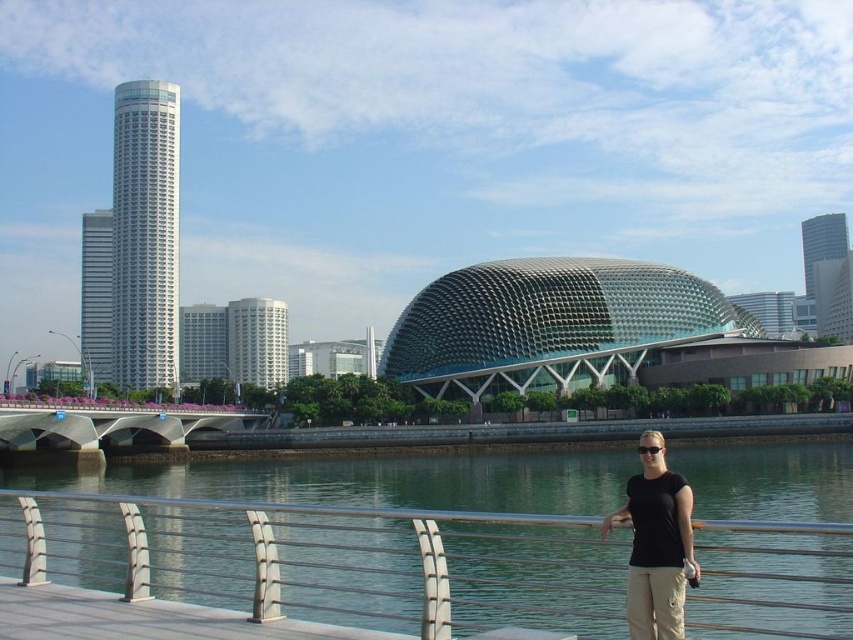
Does black matte shirt at lower center have a greater width compared to concrete bridge at center?

No.

From the picture: Does black matte shirt at lower center appear under concrete bridge at center?

No.

Does point (660, 582) lie behind point (84, 435)?

No, it is in front of (84, 435).

Image resolution: width=853 pixels, height=640 pixels. I want to click on black matte shirt at lower center, so click(x=656, y=544).

Is greenish-blue water at lower center smaller than black matte shirt at lower center?

Actually, greenish-blue water at lower center might be larger than black matte shirt at lower center.

Looking at this image, is greenish-blue water at lower center bigger than black matte shirt at lower center?

Indeed, greenish-blue water at lower center has a larger size compared to black matte shirt at lower center.

Is point (433, 600) behind point (670, 621)?

Yes.

At what (x,y) coordinates should I click in order to perform the action: click on greenish-blue water at lower center. Please return your answer as a coordinate pair (x, y). Looking at the image, I should click on (354, 536).

Does greenish-blue water at lower center appear on the right side of concrete bridge at center?

Correct, you'll find greenish-blue water at lower center to the right of concrete bridge at center.

The width and height of the screenshot is (853, 640). Identify the location of greenish-blue water at lower center. [354, 536].

Locate an element on the screen. This screenshot has height=640, width=853. greenish-blue water at lower center is located at coordinates (x=354, y=536).